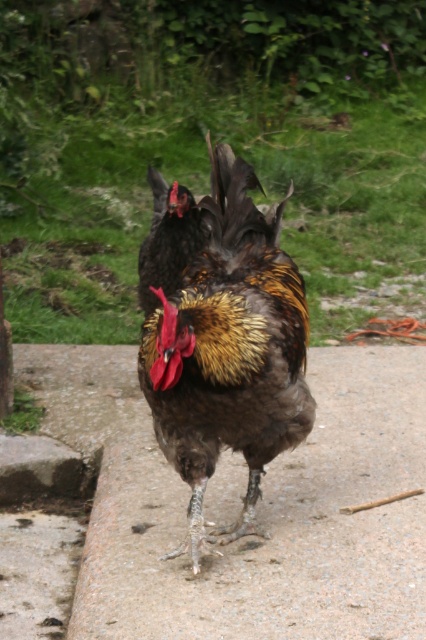
Between point (123, 532) and point (301, 330), which one is positioned behind?

The point (123, 532) is more distant.

Describe the element at coordinates (273, 524) in the screenshot. I see `gray concrete pavement at center` at that location.

What are the coordinates of `gray concrete pavement at center` in the screenshot? It's located at (273, 524).